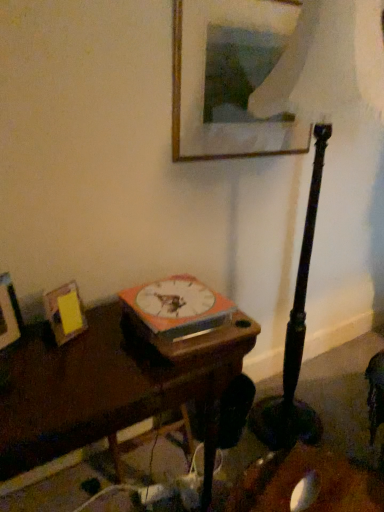
Locate an element on the screen. The image size is (384, 512). free location above dark wood table at center (from a real-world perspective) is located at coordinates point(92,350).